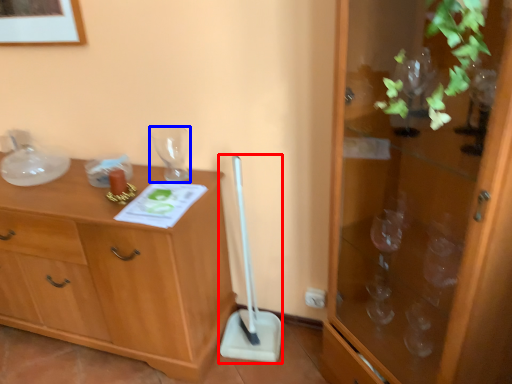
Question: Among these objects, which one is nearest to the camera, shovel (highlighted by a red box) or glass vase (highlighted by a blue box)?

Choices:
 (A) shovel
 (B) glass vase

Answer: (A)